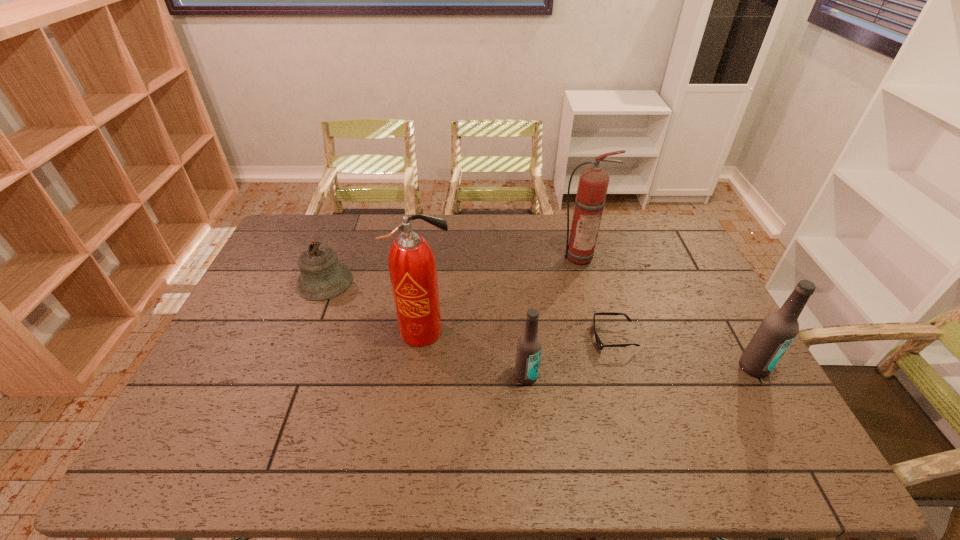
Locate an element on the screen. the left beer bottle is located at coordinates (529, 345).

Image resolution: width=960 pixels, height=540 pixels. In order to click on the third shortest object in this screenshot , I will do `click(529, 345)`.

At what (x,y) coordinates should I click in order to perform the action: click on the rightmost object. Please return your answer as a coordinate pair (x, y). Looking at the image, I should click on (778, 329).

Where is `the taller beer bottle`? The width and height of the screenshot is (960, 540). the taller beer bottle is located at coordinates point(778,329).

Where is `the farther fire extinguisher`? The height and width of the screenshot is (540, 960). the farther fire extinguisher is located at coordinates (593, 183).

This screenshot has height=540, width=960. I want to click on sunglasses, so click(598, 341).

You are a GUI agent. You are given a task and a screenshot of the screen. Output one action in this format:
    pyautogui.click(x=<x>, y=<y>)
    Task: Click on the left fire extinguisher
    This screenshot has height=540, width=960.
    Given the screenshot: What is the action you would take?
    pyautogui.click(x=412, y=268)

Find the location of a particular element. the second object from left to right is located at coordinates (412, 268).

You are a GUI agent. You are given a task and a screenshot of the screen. Output one action in this format:
    pyautogui.click(x=<x>, y=<y>)
    Task: Click on the fifth tallest object
    The height and width of the screenshot is (540, 960).
    Given the screenshot: What is the action you would take?
    pyautogui.click(x=322, y=277)

Image resolution: width=960 pixels, height=540 pixels. Identify the location of bell. (322, 277).